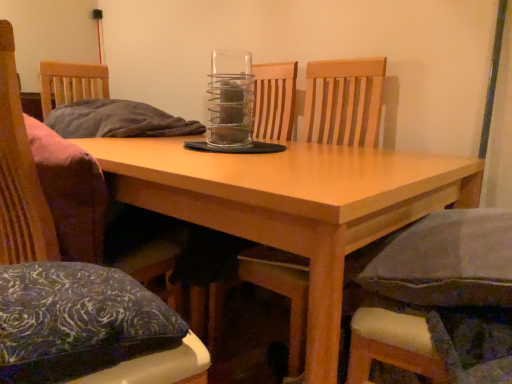
Question: Is blue patterned pillow at lower left situated inside matte black pillow at center or outside?

Choices:
 (A) outside
 (B) inside

Answer: (A)

Question: In terms of size, does blue patterned pillow at lower left appear bigger or smaller than matte black pillow at center?

Choices:
 (A) small
 (B) big

Answer: (A)

Question: Which object is the farthest from the clear glass spiral at center?

Choices:
 (A) matte black pillow at center
 (B) wooden chair at center, which is the second chair in right-to-left order
 (C) blue patterned pillow at lower left
 (D) light wood table at center
 (E) fabric cushioned chair at lower right, positioned as the 1th chair in right-to-left order

Answer: (E)

Question: Estimate the real-world distances between objects in this image. Which object is farther from the blue patterned pillow at lower left?

Choices:
 (A) matte black pillow at center
 (B) fabric cushioned chair at lower right, marked as the third chair in a left-to-right arrangement
 (C) light wood table at center
 (D) wooden chair at left, marked as the third chair in a right-to-left arrangement
 (E) clear glass spiral at center

Answer: (A)